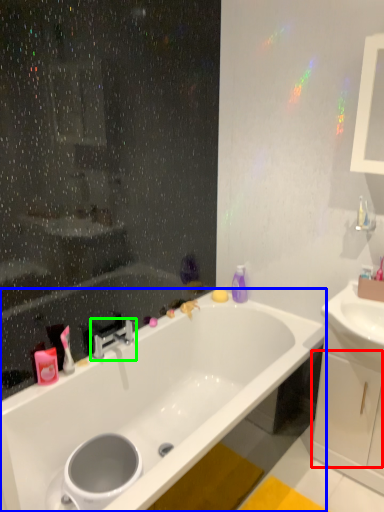
Question: Considering the real-world distances, which object is farthest from drawer (highlighted by a red box)? bathtub (highlighted by a blue box) or tap (highlighted by a green box)?

Choices:
 (A) bathtub
 (B) tap

Answer: (B)